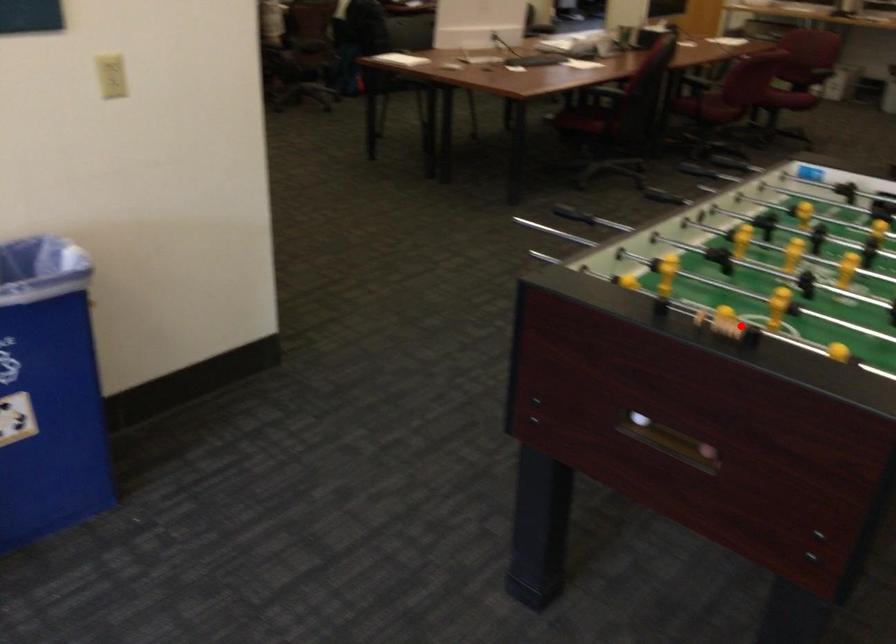
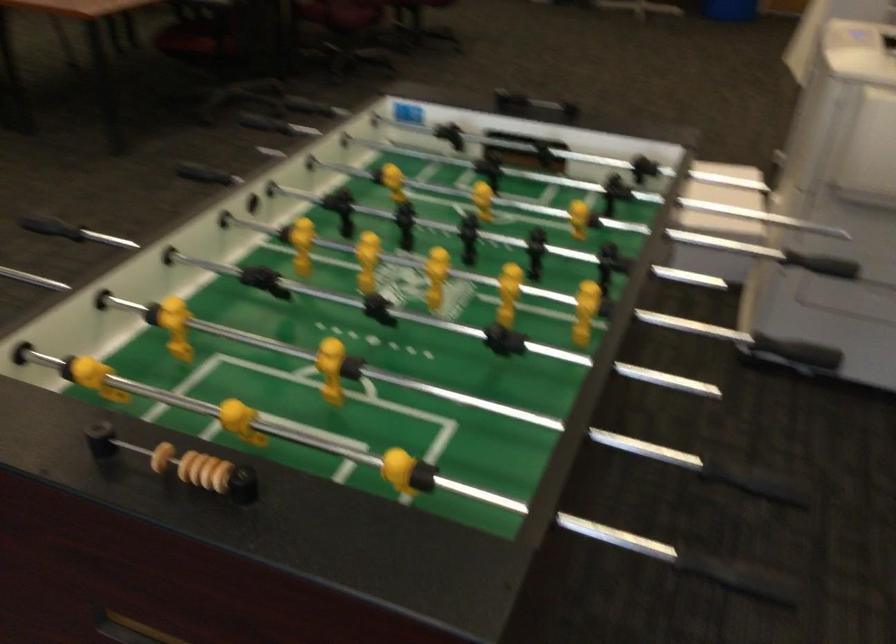
Find the pixel in the second image that matches the highlighted location in the first image.

(220, 476)